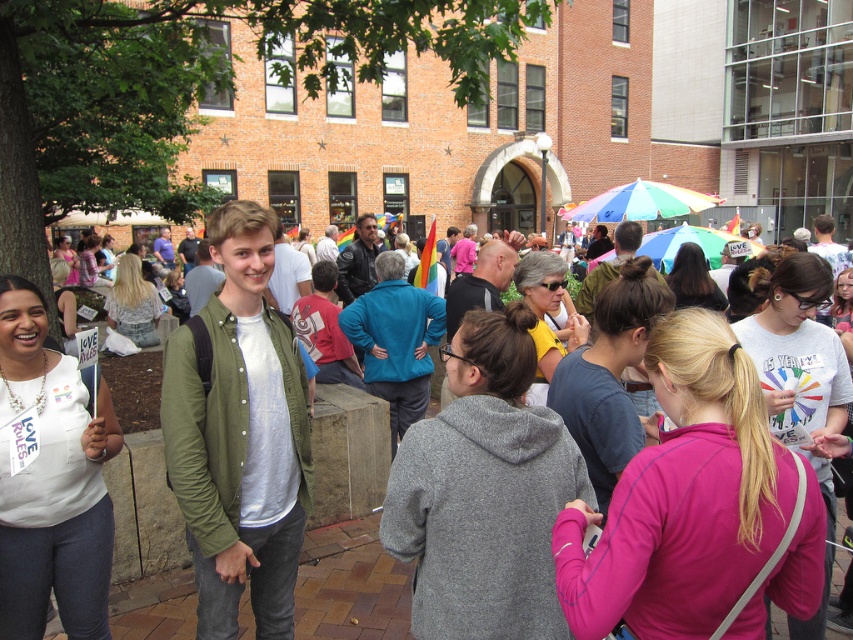
In the scene shown: You are organizing a photo shoot and need to place two fleece jackets, the pink fleece jacket at center and the gray fleece jacket at center, on a display stand. If the stand can only accommodate items up to the size of the larger jacket, will both jackets fit on the stand?

The pink fleece jacket at center has a larger width than the gray fleece jacket at center. Since the stand can accommodate the size of the larger jacket, both jackets will fit on the stand as the pink one is the bigger one and the stand can handle its size.

You are a photographer trying to capture a photo of both the pink fleece jacket at center and the gray fleece jacket at center in the same frame. Which jacket should you focus on to ensure both are visible without moving the camera?

You should focus on the pink fleece jacket at center because it is larger in size than the gray fleece jacket at center, making it easier to include both in the frame by centering the larger one.

You are a photographer at the event and want to capture a photo of the white printed t shirt at center. The camera you are using has a focus point set at coordinate point (x=798, y=356). Will the focus point be on the white printed t shirt at center?

Yes, the focus point at (x=798, y=356) corresponds to the white printed t shirt at center, so the focus will be on it.